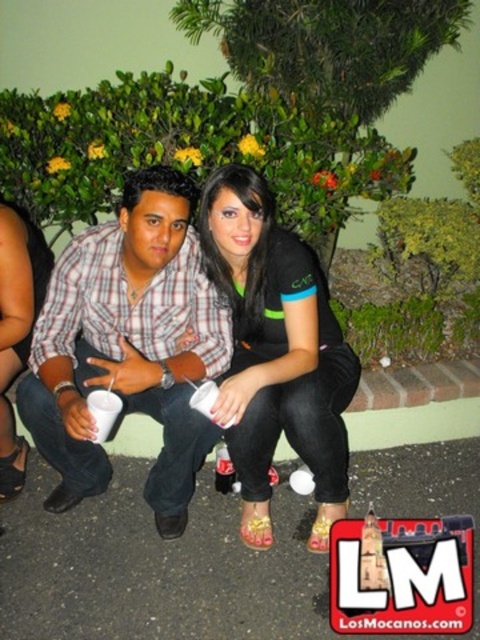
You are a photographer trying to capture a group photo of the plaid shirt at center and the black matte shirt at center. Since you want to ensure both shirts are clearly visible, which shirt should you focus on first considering their sizes?

The plaid shirt at center has a larger width than the black matte shirt at center, so you should focus on the plaid shirt at center first to ensure its details are captured clearly.